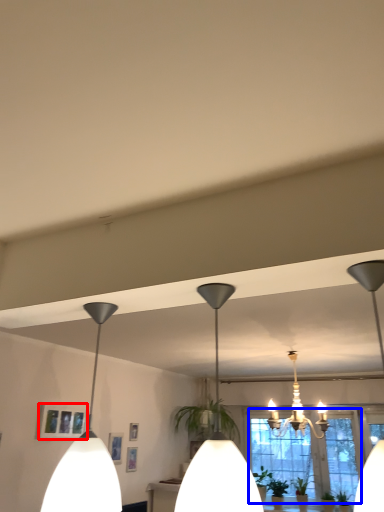
Question: Which point is further to the camera, picture frame (highlighted by a red box) or window (highlighted by a blue box)?

Choices:
 (A) picture frame
 (B) window

Answer: (B)